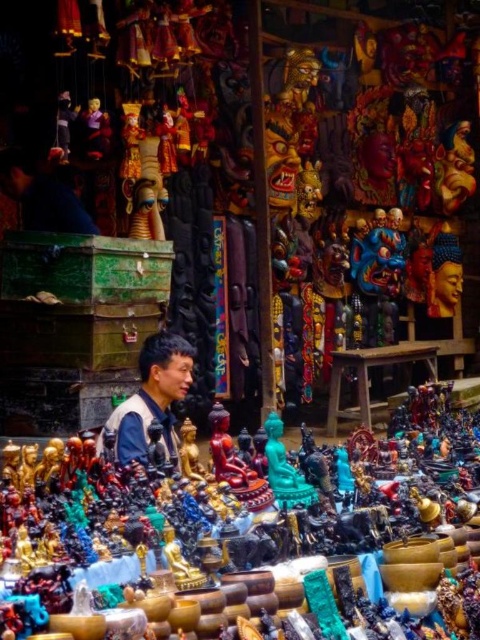
You are a vendor at the market and need to place both the shiny gold statue at center and the matte black statue at center into a box. The box can only fit items that are narrower than 30 cm. Which statue should you choose to ensure it fits?

The matte black statue at center should be chosen because it is narrower than the shiny gold statue at center, which is wider. Since the box requires items narrower than 30 cm, the matte black statue at center has a better chance of fitting within the width constraint.

You are a customer at the market stall and want to buy the shiny gold statue at center. The vendor tells you that the statue is located at coordinates point (254, 522). Can you confirm if this point is on the statue?

Yes, the point (254, 522) is on the shiny gold statue at center according to the vendor.